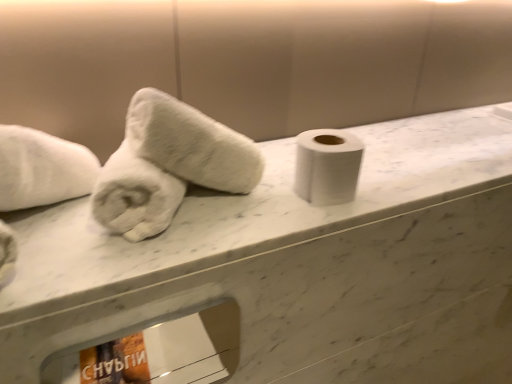
Image resolution: width=512 pixels, height=384 pixels. I want to click on vacant area that is in front of white matte toilet paper at center, so click(x=300, y=224).